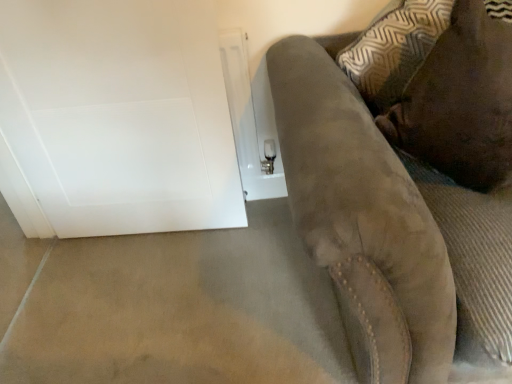
Question: From a real-world perspective, is beige carpet at lower left above or below suede couch at right?

Choices:
 (A) below
 (B) above

Answer: (A)

Question: Is beige carpet at lower left taller or shorter than suede couch at right?

Choices:
 (A) short
 (B) tall

Answer: (A)

Question: Which object is positioned farthest from the brown suede pillow at upper right?

Choices:
 (A) white glossy door at left
 (B) beige carpet at lower left
 (C) suede couch at right

Answer: (B)

Question: Based on their relative distances, which object is nearer to the white glossy door at left?

Choices:
 (A) brown suede pillow at upper right
 (B) beige carpet at lower left
 (C) suede couch at right

Answer: (B)